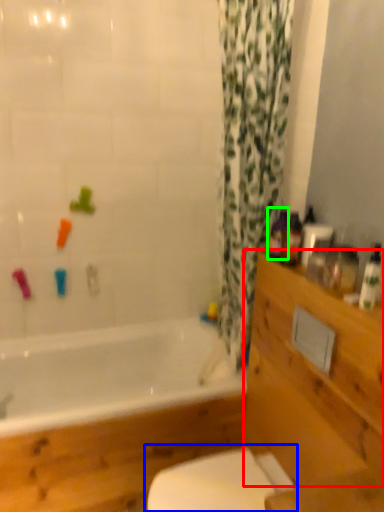
Question: Estimate the real-world distances between objects in this image. Which object is farther from drawer (highlighted by a red box), toilet (highlighted by a blue box) or toiletry (highlighted by a green box)?

Choices:
 (A) toilet
 (B) toiletry

Answer: (B)